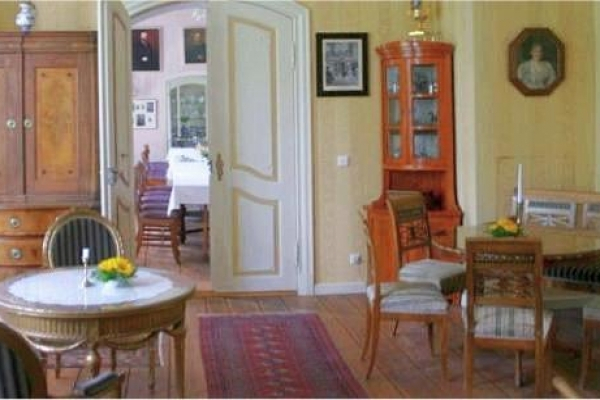
The width and height of the screenshot is (600, 400). I want to click on chairs, so click(x=378, y=311), click(x=504, y=340), click(x=106, y=382).